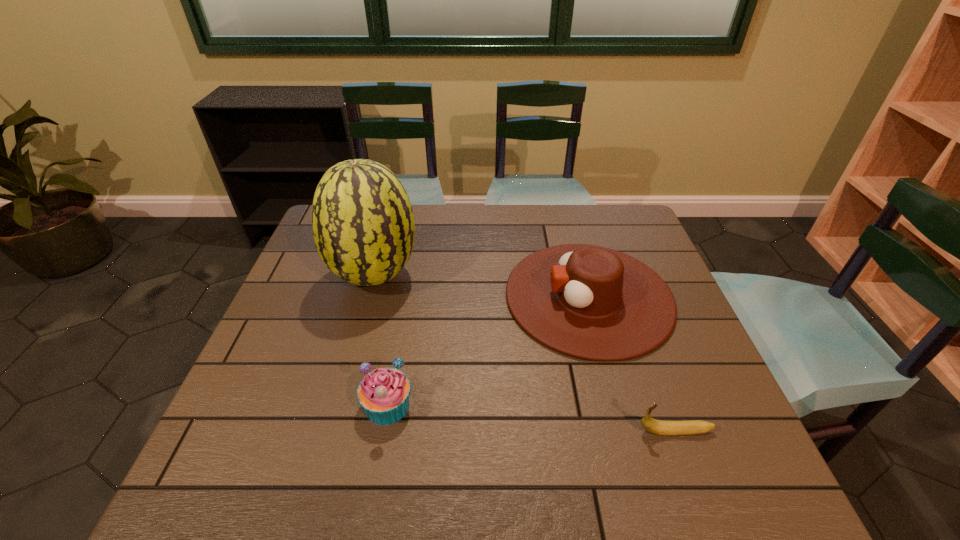
Find the location of a particular element. vacant space at the far right corner is located at coordinates (593, 228).

Locate an element on the screen. This screenshot has width=960, height=540. blank region between the tallest object and the cowboy hat is located at coordinates pyautogui.click(x=482, y=287).

The width and height of the screenshot is (960, 540). I want to click on free space between the muffin and the cowboy hat, so click(488, 351).

The width and height of the screenshot is (960, 540). In order to click on vacant space that's between the watermelon and the muffin in this screenshot , I will do `click(381, 341)`.

Where is `free space between the muffin and the tallest object`? This screenshot has width=960, height=540. free space between the muffin and the tallest object is located at coordinates (381, 341).

Identify the location of free space between the shortest object and the cowboy hat. (632, 364).

Find the location of a particular element. free space between the watermelon and the cowboy hat is located at coordinates (482, 287).

This screenshot has height=540, width=960. In order to click on vacant space in between the watermelon and the muffin in this screenshot , I will do `click(381, 341)`.

Find the location of a particular element. vacant space that's between the cowboy hat and the shortest object is located at coordinates (632, 364).

The width and height of the screenshot is (960, 540). In order to click on free space between the muffin and the watermelon in this screenshot , I will do `click(381, 341)`.